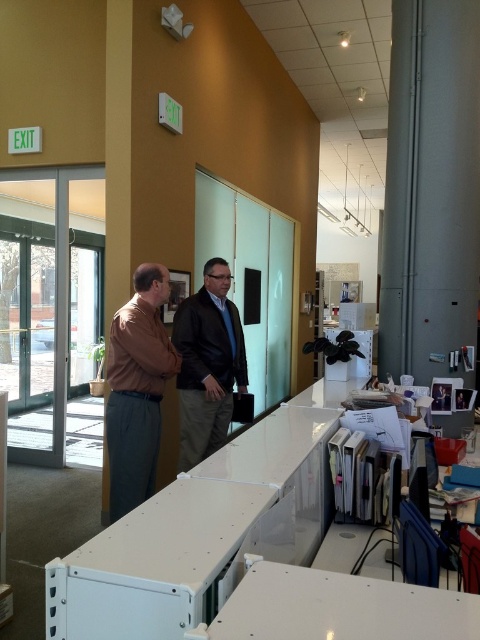
Which is more to the left, brown smooth shirt at center or dark brown leather jacket at center?

brown smooth shirt at center is more to the left.

Does brown smooth shirt at center have a greater width compared to dark brown leather jacket at center?

In fact, brown smooth shirt at center might be narrower than dark brown leather jacket at center.

Who is more forward, (168, 282) or (203, 296)?

Point (168, 282) is more forward.

Locate an element on the screen. The width and height of the screenshot is (480, 640). brown smooth shirt at center is located at coordinates (136, 388).